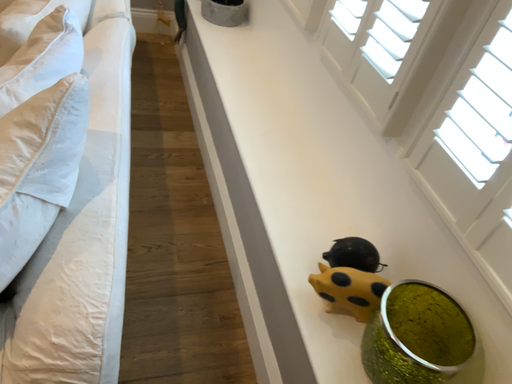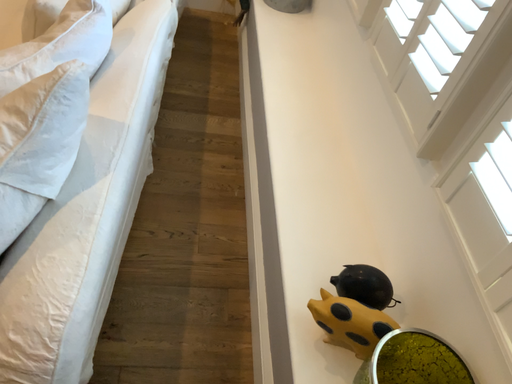
Question: Which way did the camera rotate in the video?

Choices:
 (A) rotated left
 (B) rotated right

Answer: (A)